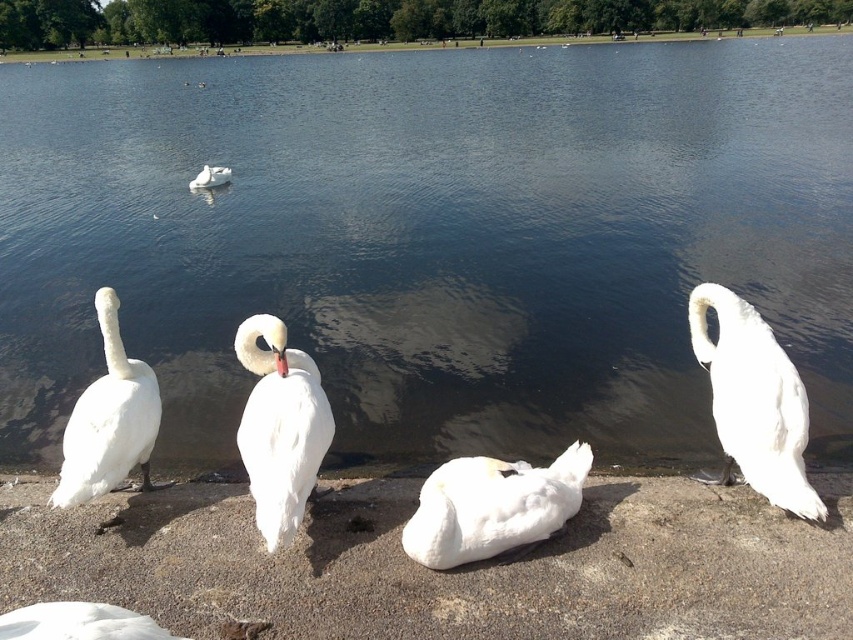
Which is more to the left, white feathered swan at left or white feathered swan at upper center?

From the viewer's perspective, white feathered swan at upper center appears more on the left side.

Find the location of a particular element. white feathered swan at left is located at coordinates (109, 420).

From the picture: How far apart are white feathered swan at right and white feathered swan at lower left?

A distance of 8.83 feet exists between white feathered swan at right and white feathered swan at lower left.

Who is higher up, white feathered swan at right or white feathered swan at lower left?

white feathered swan at right is higher up.

Find the location of a particular element. Image resolution: width=853 pixels, height=640 pixels. white feathered swan at right is located at coordinates (753, 401).

Does transparent water at center have a smaller size compared to white feathered swan at lower left?

No, transparent water at center is not smaller than white feathered swan at lower left.

Can you confirm if transparent water at center is bigger than white feathered swan at lower left?

Yes.

Who is more forward, (274, 125) or (126, 628)?

Point (126, 628)

In order to click on transparent water at center in this screenshot , I will do (x=430, y=237).